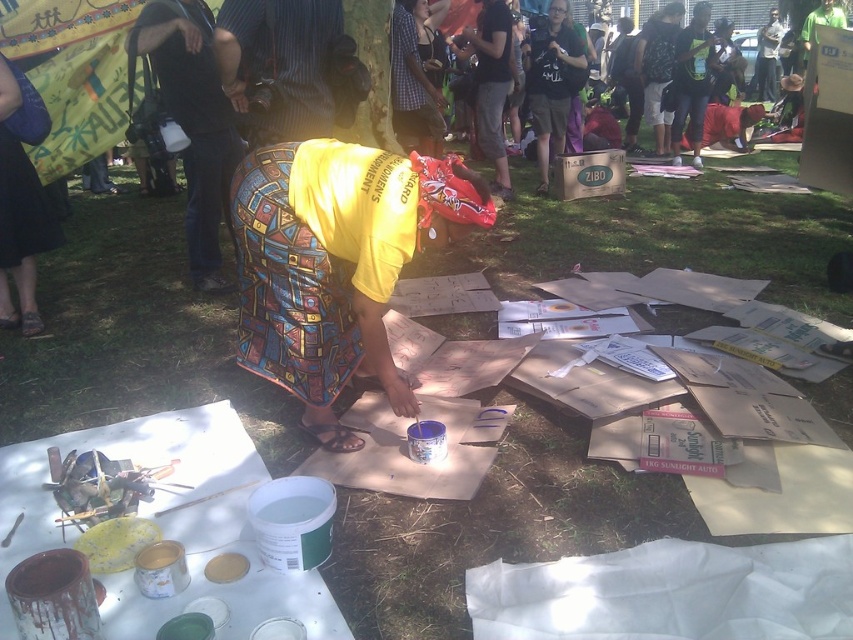
Question: Is yellow printed fabric at center positioned in front of plaid shirt at upper center?

Choices:
 (A) yes
 (B) no

Answer: (A)

Question: Among these objects, which one is nearest to the camera?

Choices:
 (A) yellow printed fabric at center
 (B) black cotton shirt at upper center

Answer: (A)

Question: Among these objects, which one is farthest from the camera?

Choices:
 (A) plaid shirt at upper center
 (B) yellow printed fabric at center
 (C) black cotton shirt at upper center

Answer: (C)

Question: In this image, where is black cotton shirt at upper center located relative to plaid shirt at upper center?

Choices:
 (A) right
 (B) left

Answer: (A)

Question: Does yellow printed fabric at center have a greater width compared to blue fabric skirt at lower left?

Choices:
 (A) no
 (B) yes

Answer: (B)

Question: Which of the following is the farthest from the observer?

Choices:
 (A) (584, 60)
 (B) (242, 246)
 (C) (396, 113)

Answer: (A)